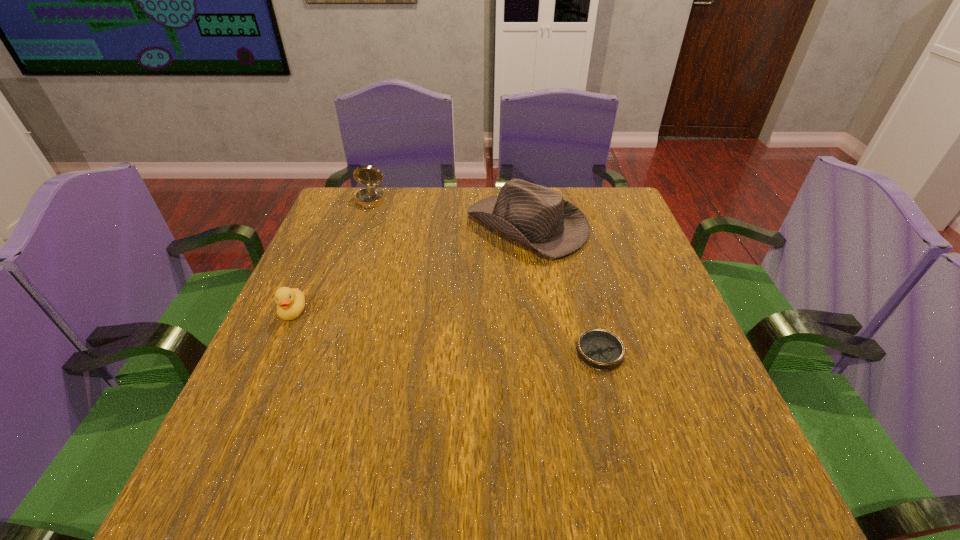
At what (x,y) coordinates should I click in order to perform the action: click on vacant space located 0.090m on the back of the nearer compass. Please return your answer as a coordinate pair (x, y). Looking at the image, I should click on (588, 304).

Image resolution: width=960 pixels, height=540 pixels. What are the coordinates of `fedora that is at the far edge` in the screenshot? It's located at (538, 218).

Where is `compass positioned at the far edge`? compass positioned at the far edge is located at coordinates (370, 197).

The height and width of the screenshot is (540, 960). Find the location of `compass present at the left edge`. compass present at the left edge is located at coordinates (370, 197).

Where is `duckling at the left edge`? This screenshot has height=540, width=960. duckling at the left edge is located at coordinates (290, 302).

I want to click on fedora at the right edge, so click(x=538, y=218).

You are a GUI agent. You are given a task and a screenshot of the screen. Output one action in this format:
    pyautogui.click(x=<x>, y=<y>)
    Task: Click on the compass that is at the right edge
    
    Given the screenshot: What is the action you would take?
    pyautogui.click(x=599, y=349)

Where is `object that is at the far left corner`? object that is at the far left corner is located at coordinates (370, 197).

This screenshot has height=540, width=960. Find the location of `object located in the far right corner section of the desktop`. object located in the far right corner section of the desktop is located at coordinates tap(538, 218).

The height and width of the screenshot is (540, 960). What are the coordinates of `free location at the far edge of the desktop` in the screenshot? It's located at (x=386, y=212).